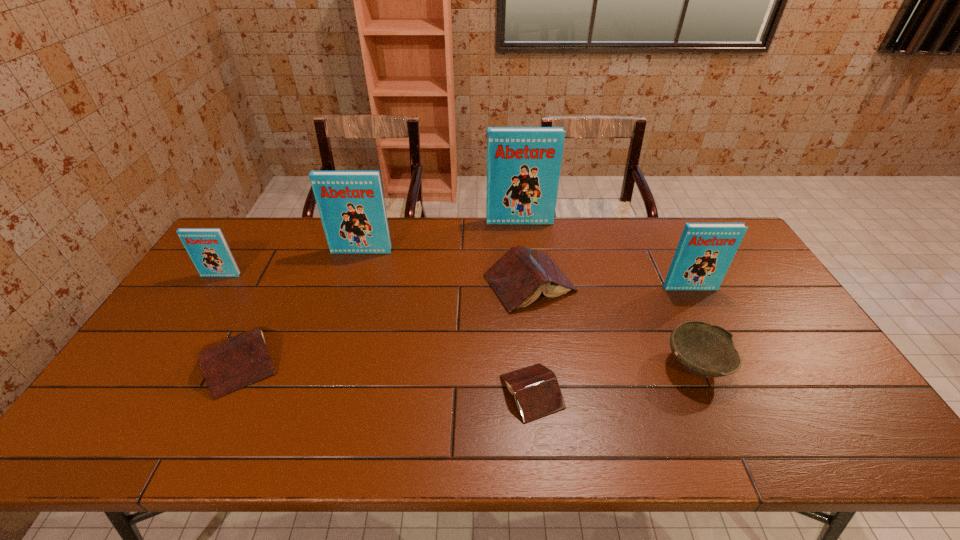
The height and width of the screenshot is (540, 960). What are the coordinates of `blank area located 0.350m on the back of the bowl` in the screenshot? It's located at (649, 259).

Where is `free region located 0.170m on the right of the leftmost brown book`? free region located 0.170m on the right of the leftmost brown book is located at coordinates (347, 361).

This screenshot has height=540, width=960. What are the coordinates of `vacant point located on the right of the smallest brown book` in the screenshot? It's located at (705, 392).

Locate an element on the screen. Image resolution: width=960 pixels, height=540 pixels. object that is positioned at the near edge is located at coordinates (537, 393).

The image size is (960, 540). Find the location of `free location at the far edge of the desktop`. free location at the far edge of the desktop is located at coordinates (322, 224).

In the image, there is a desktop. Where is `free space at the near edge`? free space at the near edge is located at coordinates (767, 443).

You are a GUI agent. You are given a task and a screenshot of the screen. Output one action in this format:
    pyautogui.click(x=<x>, y=<y>)
    Task: Click on the vacant space at the right edge of the desktop
    The height and width of the screenshot is (540, 960).
    Given the screenshot: What is the action you would take?
    (793, 393)

Where is `vacant space that's between the rightmost book and the leftmost object`? The height and width of the screenshot is (540, 960). vacant space that's between the rightmost book and the leftmost object is located at coordinates (456, 282).

Find the location of a particular element. This screenshot has width=960, height=540. empty location between the bowl and the sixth tallest book is located at coordinates (468, 363).

I want to click on free area in between the smallest brown book and the fourth tallest object, so click(x=376, y=334).